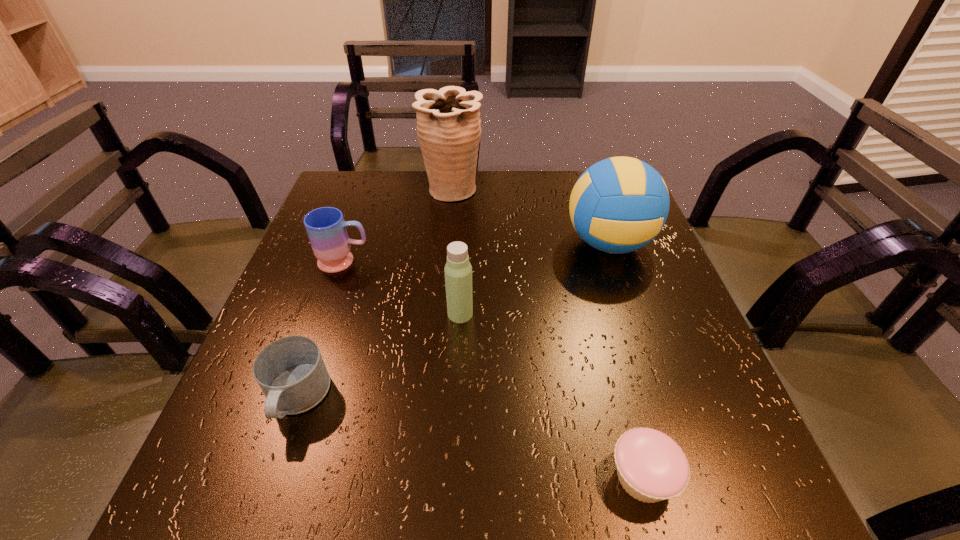
The image size is (960, 540). I want to click on the farthest object, so click(x=448, y=121).

The width and height of the screenshot is (960, 540). Identify the location of the tallest object. (448, 121).

Image resolution: width=960 pixels, height=540 pixels. Find the location of `volleyball`. volleyball is located at coordinates (618, 205).

Find the location of `the third nearest object`. the third nearest object is located at coordinates (458, 271).

Find the location of a particular element. This screenshot has width=960, height=540. thermos bottle is located at coordinates (458, 271).

Locate an element on the screen. This screenshot has height=540, width=960. the fourth tallest object is located at coordinates (326, 228).

In order to click on the farther mug in this screenshot , I will do 326,228.

At what (x,y) coordinates should I click in order to perform the action: click on the nearer mug. Please return your answer as a coordinate pair (x, y). Looking at the image, I should click on (291, 372).

The width and height of the screenshot is (960, 540). What are the coordinates of `the second nearest object` in the screenshot? It's located at (291, 372).

Locate an element on the screen. This screenshot has width=960, height=540. cupcake is located at coordinates (651, 467).